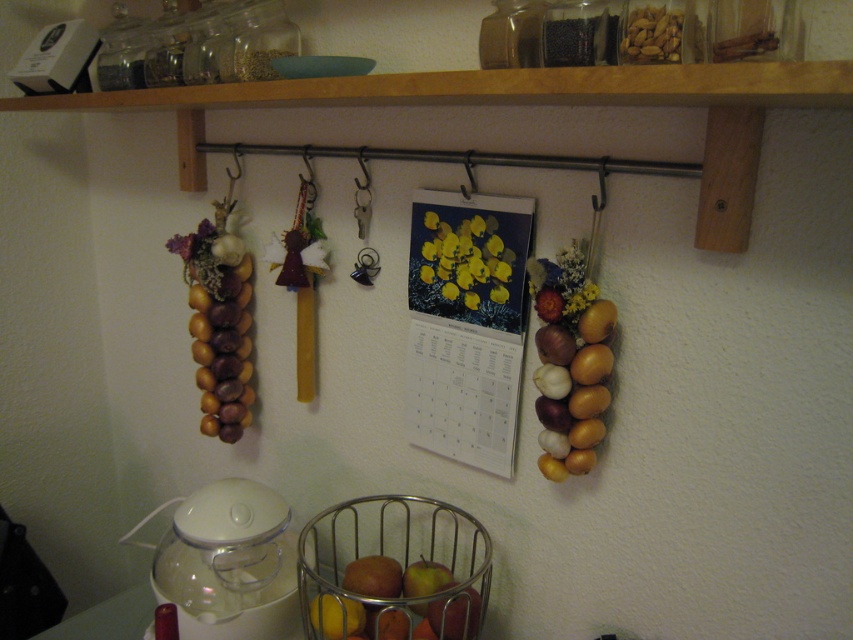
You are organizing a kitchen wall display and need to ensure that the metallic wire basket at center and the matte brown apple at center are arranged so that the taller item is placed above the shorter one. According to the current setup, which item should be positioned higher?

The metallic wire basket at center is taller than the matte brown apple at center, so it should be positioned higher to comply with the arrangement requirement.

You are standing 1 meter away from the kitchen wall. There is a point at coordinates point [306,572]. Can you reach this point with your hand?

The distance of point [306,572] from viewer is 85.94 centimeters, which is less than 1 meter. Therefore, you can reach this point with your hand since you are standing 1 meter away from the wall.

You are organizing the kitchen wall and notice the metallic wire basket at center and the matte brown onion at right. Which object is taller?

The metallic wire basket at center is taller than the matte brown onion at right.